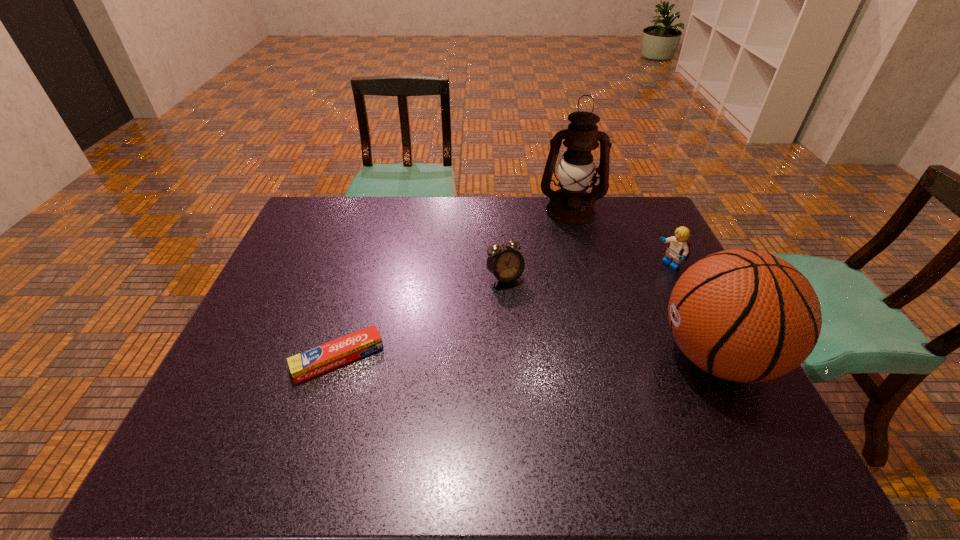
Locate an element on the screen. This screenshot has width=960, height=540. the leftmost object is located at coordinates (320, 359).

At what (x,y) coordinates should I click in order to perform the action: click on toothpaste. Please return your answer as a coordinate pair (x, y). Image resolution: width=960 pixels, height=540 pixels. Looking at the image, I should click on (320, 359).

The height and width of the screenshot is (540, 960). Identify the location of basketball. (743, 315).

Where is `alarm clock`? The height and width of the screenshot is (540, 960). alarm clock is located at coordinates pyautogui.click(x=506, y=264).

Where is `lantern`? lantern is located at coordinates (571, 205).

This screenshot has width=960, height=540. In order to click on the third object from right to left in this screenshot , I will do `click(571, 205)`.

Locate an element on the screen. Lego is located at coordinates (678, 249).

Find the location of a particular element. This screenshot has width=960, height=540. vacant space located 0.050m on the right of the leftmost object is located at coordinates (402, 358).

The image size is (960, 540). In order to click on vacant space positioned on the side where the inflation valve is located in this screenshot , I will do `click(503, 356)`.

At what (x,y) coordinates should I click in order to perform the action: click on vacant area located 0.080m on the side where the inflation valve is located. Please return your answer as a coordinate pair (x, y). Image resolution: width=960 pixels, height=540 pixels. Looking at the image, I should click on (623, 356).